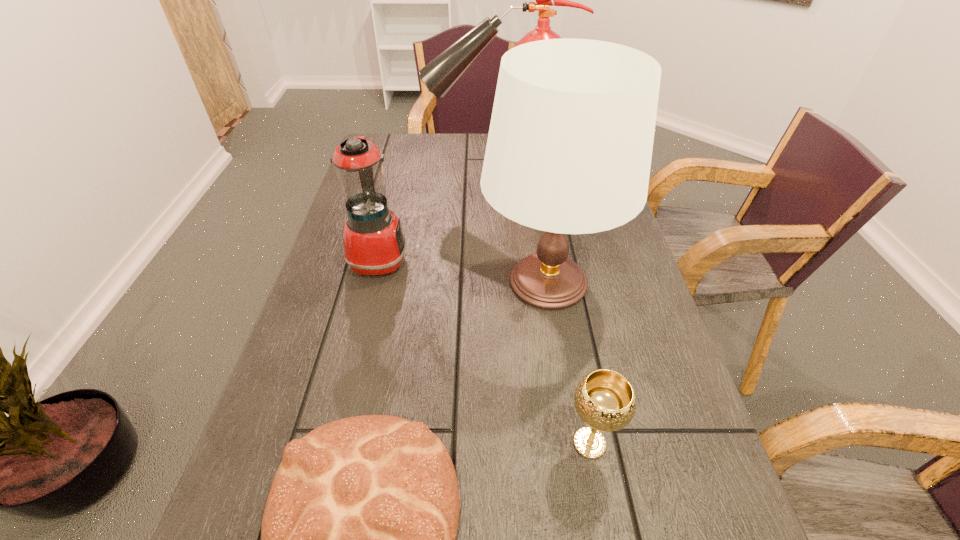
You are a GUI agent. You are given a task and a screenshot of the screen. Output one action in this format:
    pyautogui.click(x=<x>, y=<y>)
    Task: Click on the unoccupied area between the fourth tallest object and the third shortest object
    
    Given the screenshot: What is the action you would take?
    pyautogui.click(x=485, y=351)

Where is `free space that is in between the farthest object and the lamp`? free space that is in between the farthest object and the lamp is located at coordinates (523, 231).

The height and width of the screenshot is (540, 960). What are the coordinates of `free point between the chalice and the fire extinguisher` in the screenshot? It's located at (543, 311).

Point out which object is positioned as the fourth nearest to the fire extinguisher. Please provide its 2D coordinates. Your answer should be formatted as a tuple, i.e. [(x, y)], where the tuple contains the x and y coordinates of a point satisfying the conditions above.

[(358, 538)]

Identify the location of object that is the closest one to the bread. (605, 400).

You are a GUI agent. You are given a task and a screenshot of the screen. Output one action in this format:
    pyautogui.click(x=<x>, y=<y>)
    Task: Click on the free space that satisfies the following two spatial constraints: 1. at the nozzle end of the farthest object; 2. on the back side of the lamp
    The width and height of the screenshot is (960, 540).
    Given the screenshot: What is the action you would take?
    pyautogui.click(x=503, y=282)

Find the location of `free point that satisfies the following two spatial constraints: 1. at the nozzle end of the lamp; 2. on the left side of the fire extinguisher`. free point that satisfies the following two spatial constraints: 1. at the nozzle end of the lamp; 2. on the left side of the fire extinguisher is located at coordinates (503, 282).

The height and width of the screenshot is (540, 960). Identify the location of vacant region that satisfies the following two spatial constraints: 1. at the nozzle end of the fire extinguisher; 2. on the back side of the fourth tallest object. (513, 443).

Locate an element on the screen. vacant area that satisfies the following two spatial constraints: 1. at the nozzle end of the farthest object; 2. on the back side of the lamp is located at coordinates (503, 282).